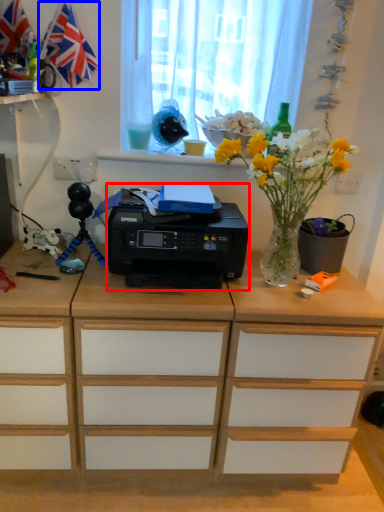
Question: Which point is closer to the camera, printer (highlighted by a red box) or flag (highlighted by a blue box)?

Choices:
 (A) printer
 (B) flag

Answer: (A)